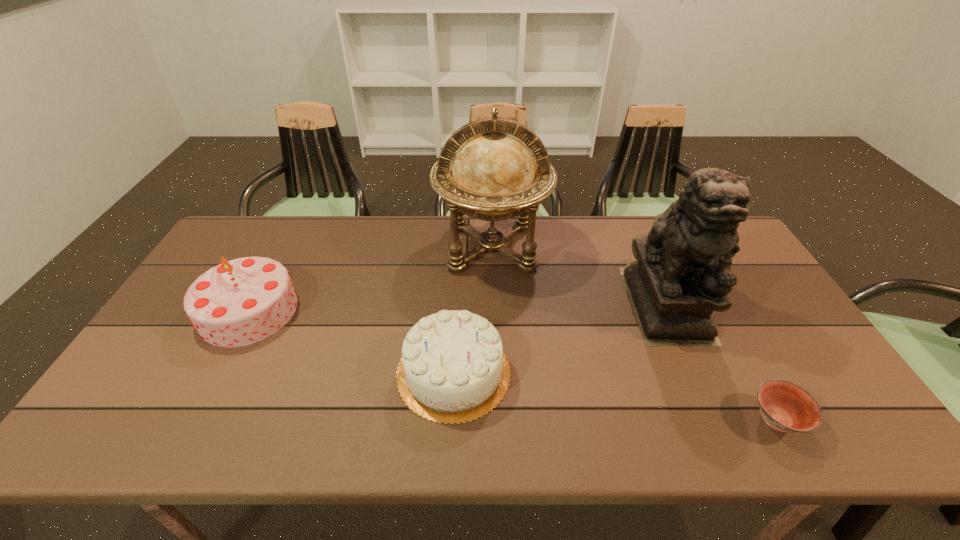
You are a GUI agent. You are given a task and a screenshot of the screen. Output one action in this format:
    pyautogui.click(x=<x>, y=<y>)
    Task: Click on the vacant region between the globe and the taller birthday cake
    Image resolution: width=960 pixels, height=540 pixels.
    Given the screenshot: What is the action you would take?
    pyautogui.click(x=371, y=279)

Image resolution: width=960 pixels, height=540 pixels. I want to click on free area in between the shortest object and the globe, so click(x=635, y=334).

Where is `empty space that is in between the sculpture and the globe`? This screenshot has height=540, width=960. empty space that is in between the sculpture and the globe is located at coordinates (579, 275).

What are the coordinates of `vacant area between the shorter birthday cake and the third tallest object` in the screenshot? It's located at (351, 341).

Select which object is the second closest to the shortest object. Please provide its 2D coordinates. Your answer should be formatted as a tuple, i.e. [(x, y)], where the tuple contains the x and y coordinates of a point satisfying the conditions above.

[(453, 369)]

Locate an element on the screen. The width and height of the screenshot is (960, 540). object identified as the third closest to the bowl is located at coordinates (493, 176).

Where is `blank space that satisfies the following two spatial constraints: 1. on the front-facing side of the globe; 2. on the right side of the bowl`? This screenshot has height=540, width=960. blank space that satisfies the following two spatial constraints: 1. on the front-facing side of the globe; 2. on the right side of the bowl is located at coordinates (497, 420).

Where is `vacant position in the image that satisfies the following two spatial constraints: 1. on the front-facing side of the shortest object; 2. on the right side of the globe`? vacant position in the image that satisfies the following two spatial constraints: 1. on the front-facing side of the shortest object; 2. on the right side of the globe is located at coordinates (497, 420).